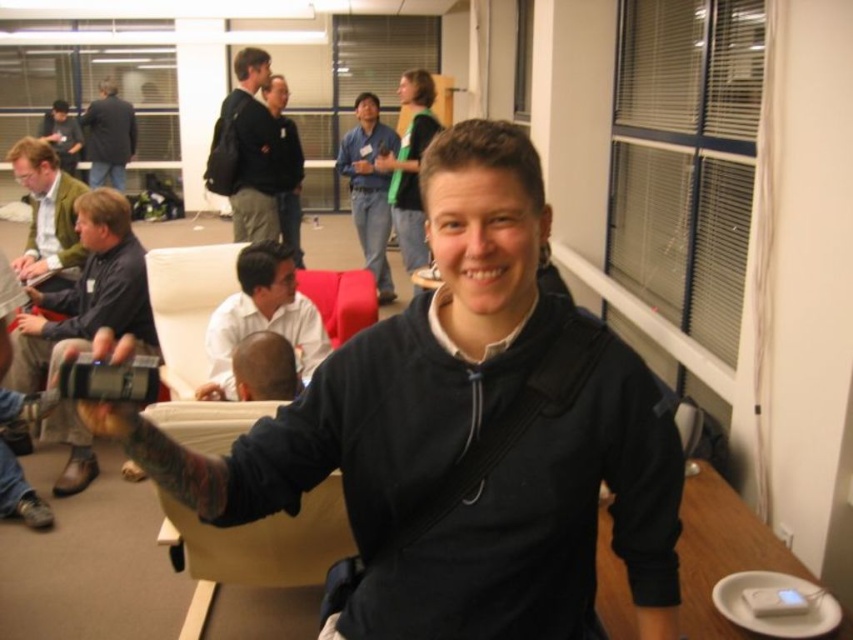
You are organizing a photo shoot and need to ensure that the dark gray backpack at upper center and the brown hair at center are both visible in the frame. Based on their positions, which object is more likely to be fully visible without obstruction?

The dark gray backpack at upper center is wider than the brown hair at center, so it might be more likely to be fully visible without obstruction since it occupies more space in the frame.

Based on the photo, you are a photographer at the event and want to capture a photo of the blue shirt at center and brown hair at center. Which object should be placed more to the left in the frame?

The blue shirt at center should be placed more to the left in the frame since it is positioned on the left side of brown hair at center.